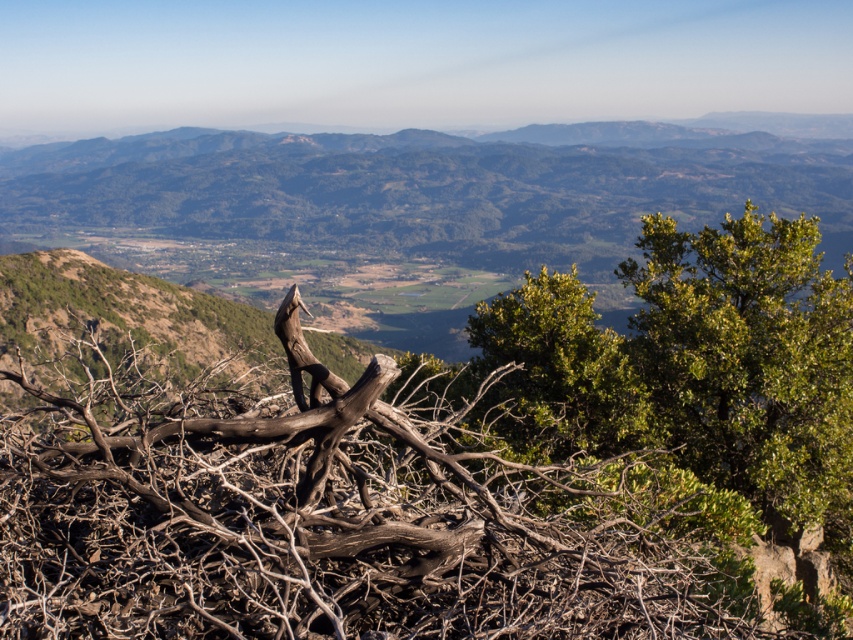
Can you confirm if brown/dry wood at center is positioned below green leafy shrub at right?

Indeed, brown/dry wood at center is positioned under green leafy shrub at right.

Does point (496, 524) come farther from viewer compared to point (755, 412)?

No, (496, 524) is closer to viewer.

At what (x,y) coordinates should I click in order to perform the action: click on brown/dry wood at center. Please return your answer as a coordinate pair (x, y). Looking at the image, I should click on (334, 512).